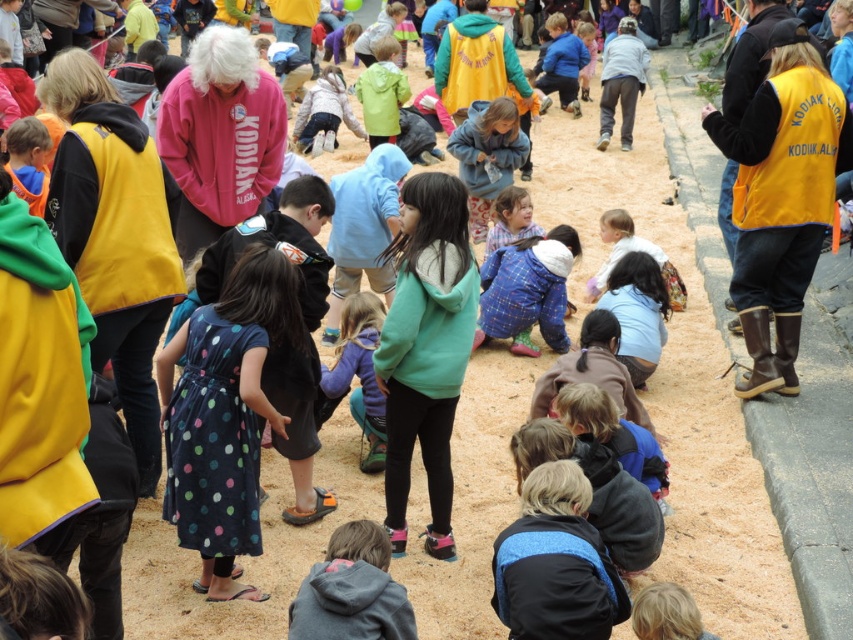
Is dark blue polka dot dress at center above light blue fabric at center?

No, dark blue polka dot dress at center is not above light blue fabric at center.

Is dark blue polka dot dress at center bigger than light blue fabric at center?

No.

Between point (167, 506) and point (305, 145), which one is positioned behind?

The point (305, 145) is behind.

Locate an element on the screen. The image size is (853, 640). dark blue polka dot dress at center is located at coordinates (224, 417).

Does point (306, 627) come in front of point (360, 465)?

Yes, point (306, 627) is in front of point (360, 465).

Find the location of a particular element. The width and height of the screenshot is (853, 640). gray fleece hoodie at lower center is located at coordinates (352, 589).

Locate an element on the screen. The image size is (853, 640). gray fleece hoodie at lower center is located at coordinates (352, 589).

Is pink fleece jacket at center shorter than gray fleece hoodie at lower center?

No.

Which is more to the left, pink fleece jacket at center or gray fleece hoodie at lower center?

Positioned to the left is pink fleece jacket at center.

Who is more distant from viewer, (202, 232) or (341, 548)?

The point (202, 232) is behind.

You are a GUI agent. You are given a task and a screenshot of the screen. Output one action in this format:
    pyautogui.click(x=<x>, y=<y>)
    Task: Click on the pink fleece jacket at center
    The image size is (853, 640).
    Given the screenshot: What is the action you would take?
    pyautogui.click(x=219, y=134)